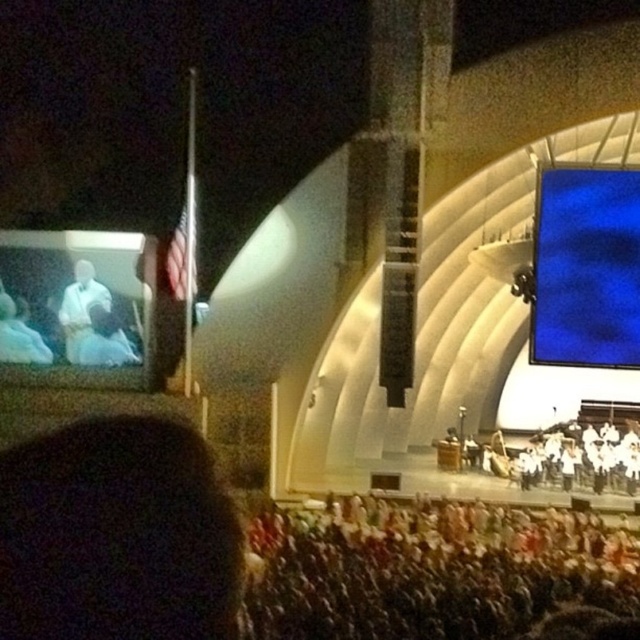
You are a photographer at the event and need to capture a photo that includes both the dark hair at lower left and the white fabric crowd at lower center. Which object should you focus on first to ensure both are in frame?

The dark hair at lower left has a smaller width than the white fabric crowd at lower center, so you should focus on the white fabric crowd at lower center first to ensure both fit in the frame.

You are a photographer positioned at the back of the auditorium and need to capture a clear shot of both the white fabric crowd at lower center and the white cloth at left. Given that your camera can focus on objects up to 50 meters away, will you be able to photograph both subjects clearly?

The white fabric crowd at lower center is 47.42 meters away from the white cloth at left. Since your camera can focus up to 50 meters, you can photograph both subjects clearly as the distance between them is within the camera range.

You are an event organizer planning to place a new decorative banner. You need to decide between two locations on the stage. The banner must be placed either on the white fabric crowd at lower center or the white cloth at left. Which location offers more space for the banner?

The white fabric crowd at lower center has a larger size compared to the white cloth at left, so it offers more space for the banner.